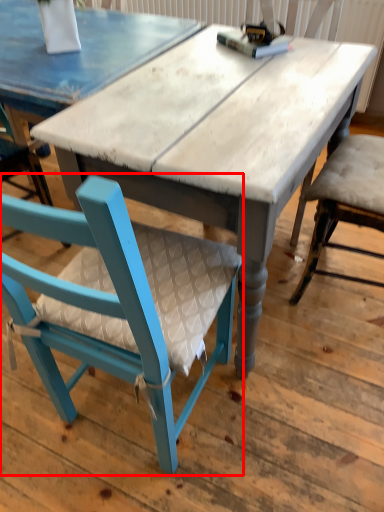
Question: From the image's perspective, where is chair (annotated by the red box) located in relation to table in the image?

Choices:
 (A) below
 (B) above

Answer: (A)